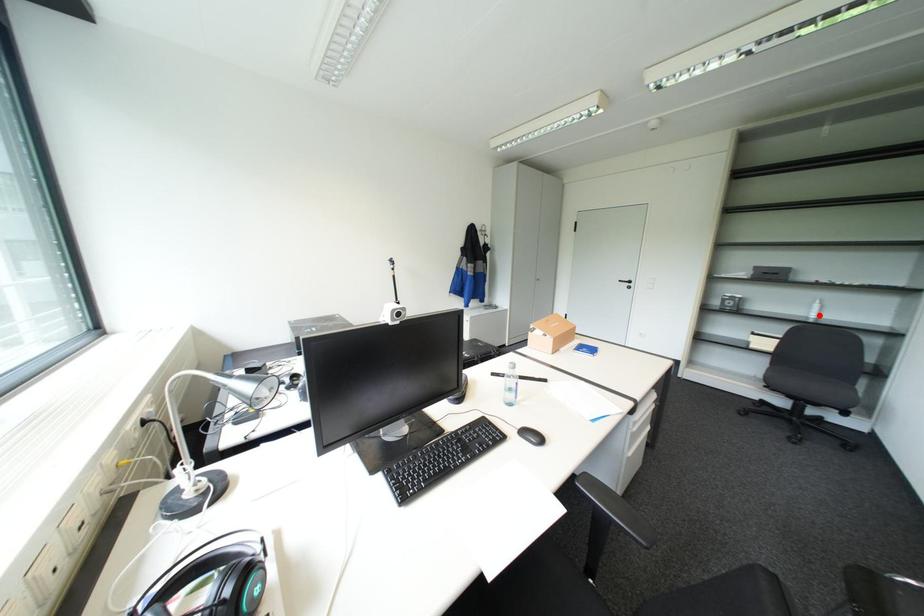
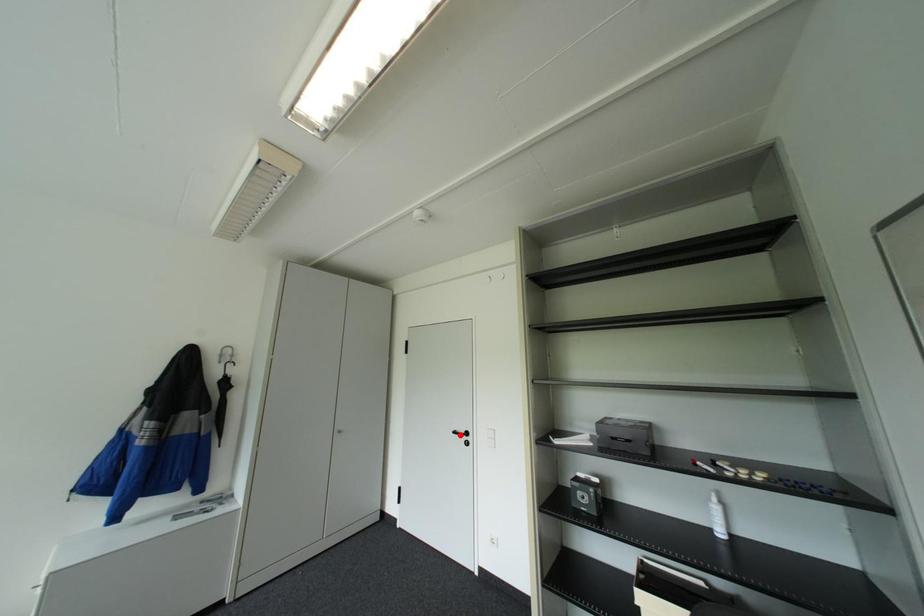
I am providing you with two images of the same scene from different viewpoints. A red point is marked on the first image and another point is marked on the second image. Do the highlighted points in image1 and image2 indicate the same real-world spot?

No